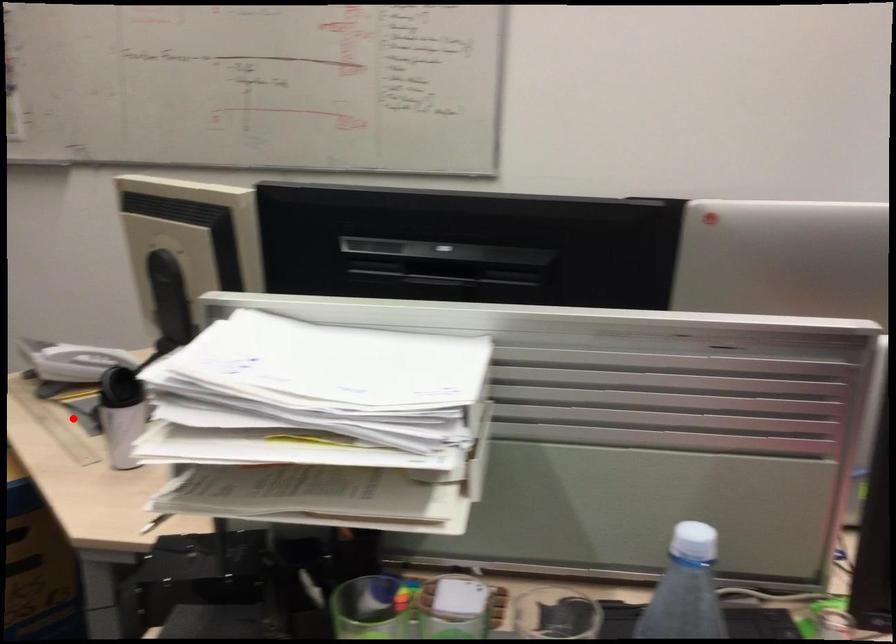
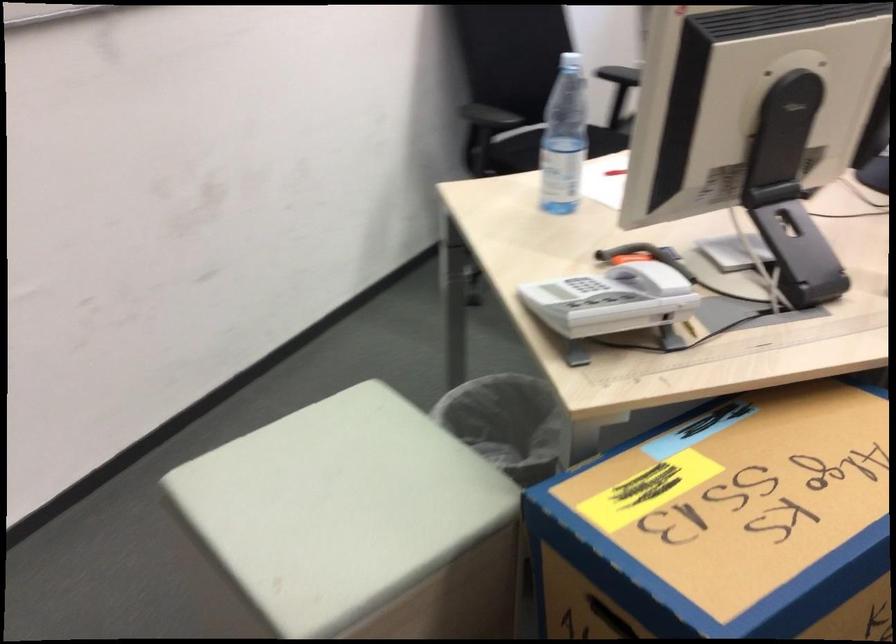
Question: I am providing you with two images of the same scene from different viewpoints. A red point is marked on the first image. Is the red point's position out of view in image 2?

Choices:
 (A) Yes
 (B) No

Answer: (B)